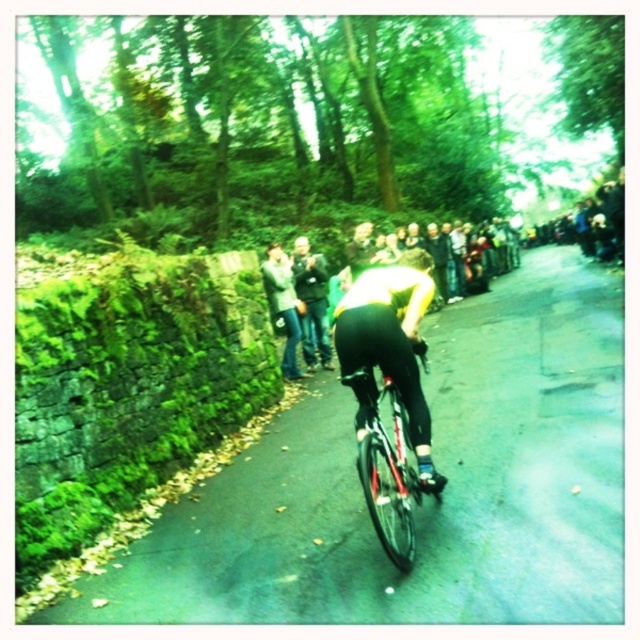
Who is more distant from viewer, (573, 257) or (289, 372)?

Positioned behind is point (573, 257).

Where is `jeans-clad crowd at center`? jeans-clad crowd at center is located at coordinates (566, 308).

Describe the element at coordinates (566, 308) in the screenshot. I see `jeans-clad crowd at center` at that location.

This screenshot has height=640, width=640. Find the location of `jeans-clad crowd at center`. jeans-clad crowd at center is located at coordinates (566, 308).

Does jeans-clad crowd at center appear on the right side of shiny metallic bicycle at center?

Yes, jeans-clad crowd at center is to the right of shiny metallic bicycle at center.

Which is in front, point (605, 342) or point (401, 570)?

Point (401, 570)

Between point (552, 284) and point (401, 528), which one is positioned in front?

Point (401, 528)

Find the location of a particular element. Image resolution: width=640 pixels, height=640 pixels. jeans-clad crowd at center is located at coordinates (566, 308).

Can you confirm if shiny metallic bicycle at center is bigger than jeans at center?

Yes.

Locate an element on the screen. shiny metallic bicycle at center is located at coordinates (387, 468).

Is point (378, 483) closer to camera compared to point (300, 324)?

That is True.

The height and width of the screenshot is (640, 640). Identify the location of shiny metallic bicycle at center. (387, 468).